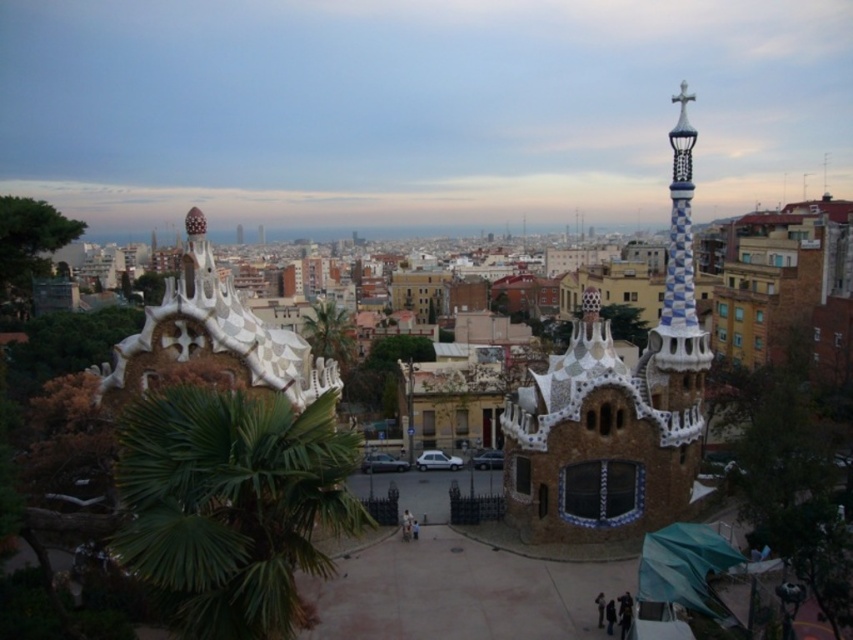
In the scene shown: Does green leafy palm at lower left appear under checkerboard ceramic tower at center?

Indeed, green leafy palm at lower left is positioned under checkerboard ceramic tower at center.

The height and width of the screenshot is (640, 853). Describe the element at coordinates (231, 506) in the screenshot. I see `green leafy palm at lower left` at that location.

I want to click on green leafy palm at lower left, so click(x=231, y=506).

Is checkerboard ceramic tower at center to the right of green leafy palm tree at center from the viewer's perspective?

Correct, you'll find checkerboard ceramic tower at center to the right of green leafy palm tree at center.

Who is more forward, (625, 468) or (326, 332)?

Point (625, 468) is more forward.

Locate an element on the screen. The image size is (853, 640). checkerboard ceramic tower at center is located at coordinates (614, 406).

Is point (202, 474) more distant than point (337, 348)?

No, (202, 474) is in front of (337, 348).

This screenshot has width=853, height=640. What are the coordinates of `green leafy palm at lower left` in the screenshot? It's located at (231, 506).

Who is more distant from viewer, (195, 598) or (332, 355)?

The point (332, 355) is more distant.

The image size is (853, 640). What are the coordinates of `green leafy palm at lower left` in the screenshot? It's located at (231, 506).